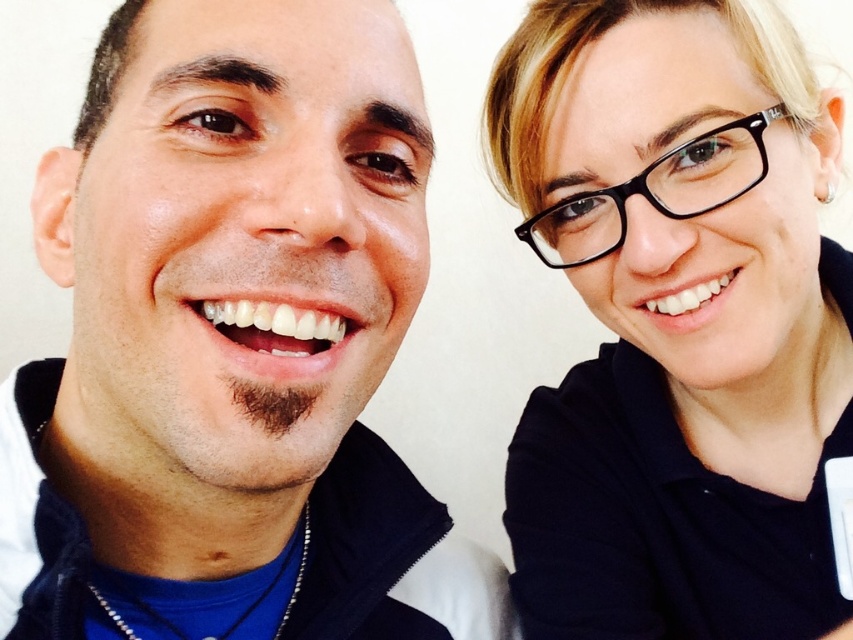
Is matte black jacket at left taller than black matte glasses at upper right?

Incorrect, matte black jacket at left's height is not larger of black matte glasses at upper right's.

Does point (231, 433) lie behind point (595, 460)?

No, (231, 433) is closer to viewer.

Does point (158, 316) come farther from viewer compared to point (608, 170)?

No, (158, 316) is in front of (608, 170).

Where is `matte black jacket at left`? The width and height of the screenshot is (853, 640). matte black jacket at left is located at coordinates (231, 342).